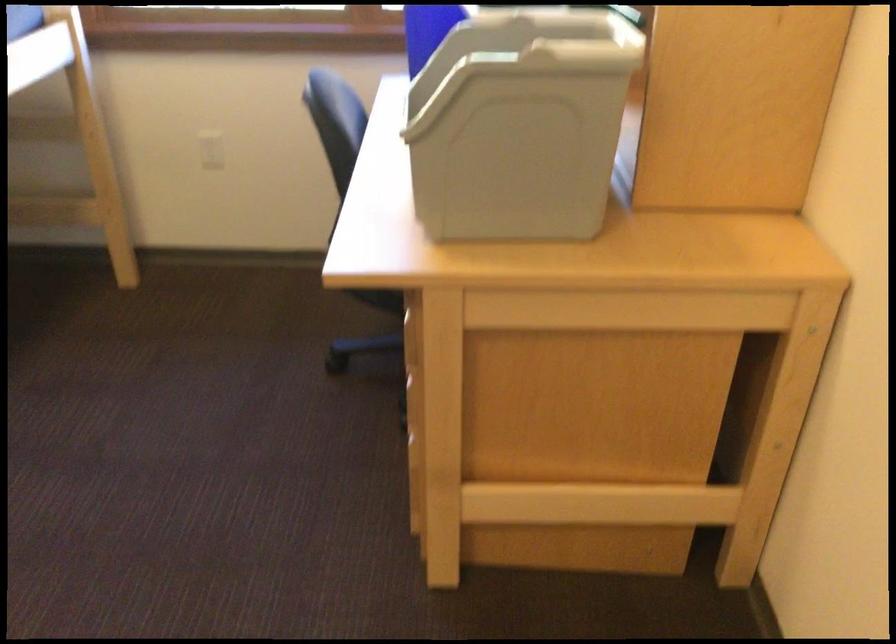
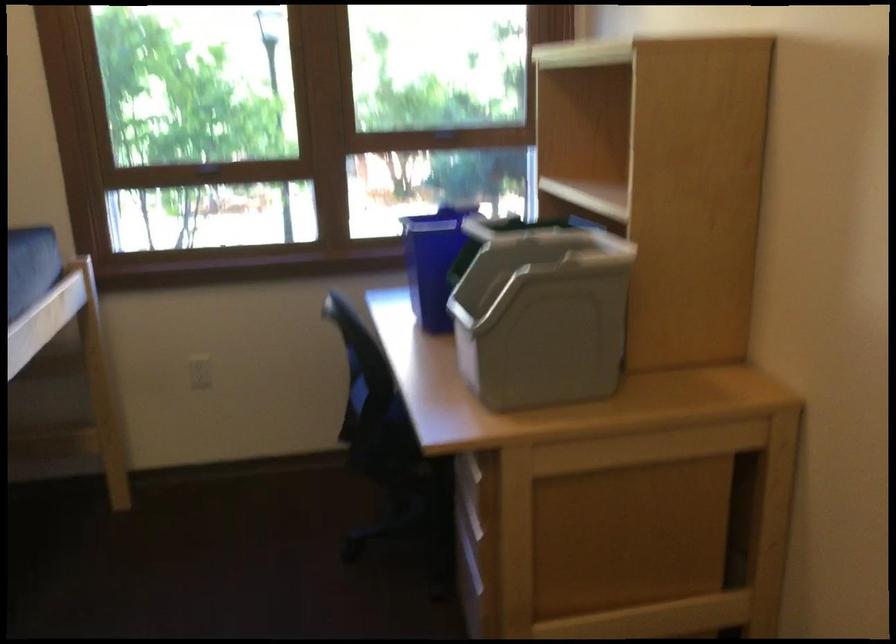
Find the pixel in the second image that matches the point at 502,120 in the first image.

(540, 313)